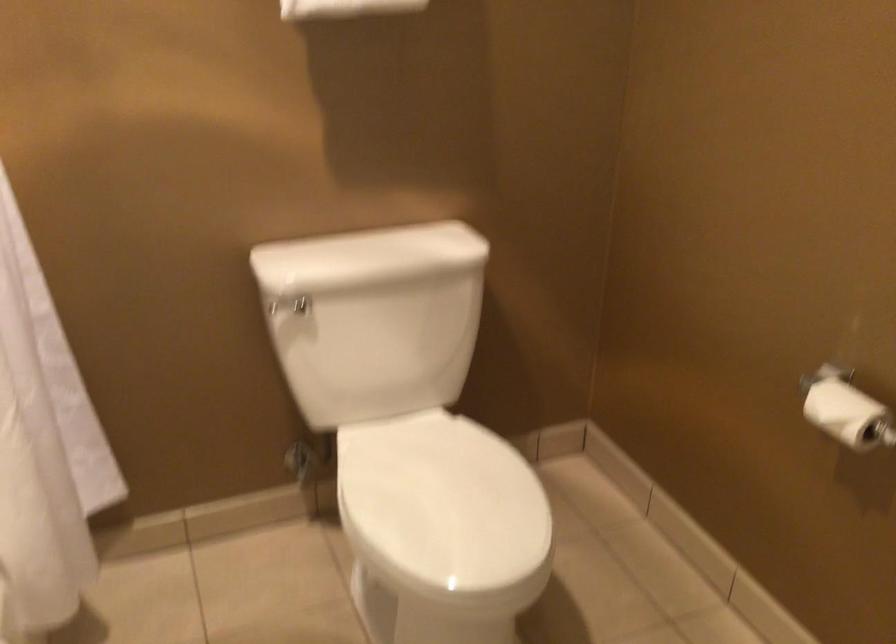
I want to click on toilet flush handle, so click(x=289, y=307).